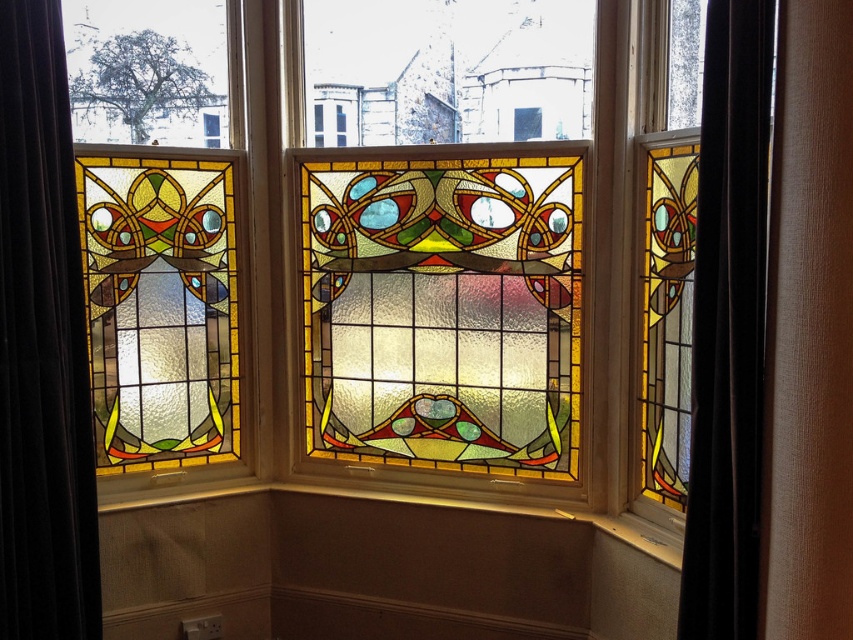
You are standing in the room and want to hang a small decorative hook on the wall. The hook needs to be placed below the black velvet curtain at right so it doesn not block the view of the matte wood window sill at center. Can you do this?

The black velvet curtain at right is above the matte wood window sill at center, so yes, you can place the hook below the curtain while keeping it visible.

Based on the photo, you are an interior designer planning to place a decorative vase on the matte wood window sill at center. However, you also have a large rectangular mirror that needs to be hung on the wall near the velvet dark brown curtain at left. Considering their sizes, which object has more space available for placement?

The matte wood window sill at center has more space available for placement since its width is greater than the velvet dark brown curtain at left.

You are a photographer standing in front of the black velvet curtain at right. You want to take a photo of the central stained glass window. Your camera is 1.90 meters away from the curtain. Can you reach the camera to adjust it without moving your position?

The black velvet curtain at right and the camera are 1.90 meters apart. Since you are standing in front of the curtain, the camera is 1.90 meters away from you. To adjust the camera without moving, you need to have an arm span or reach that exceeds 1.90 meters. The average human arm span is about 1.6 to 1.7 meters, so it might be difficult to reach the camera unless you have an unusually long reach.